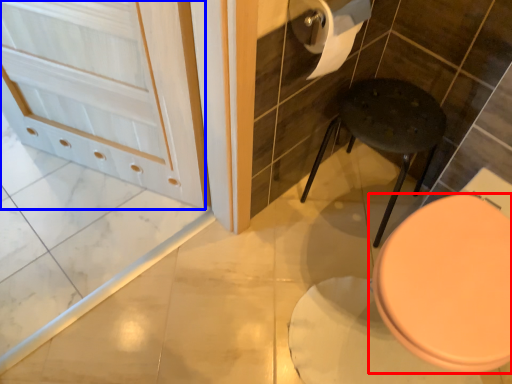
Question: Among these objects, which one is farthest to the camera, toilet (highlighted by a red box) or screen door (highlighted by a blue box)?

Choices:
 (A) toilet
 (B) screen door

Answer: (B)